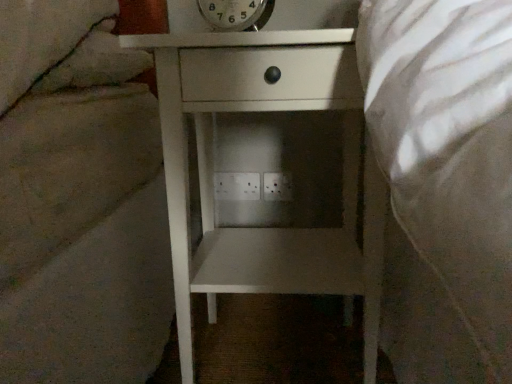
The height and width of the screenshot is (384, 512). What are the coordinates of `white plastic electric outlet at center, arranged as the 2th electric outlet when viewed from the left` in the screenshot? It's located at [x=277, y=187].

Considering the relative sizes of white matte nightstand at center and white plastic electric outlet at center, which is the 1th electric outlet in left-to-right order, in the image provided, is white matte nightstand at center bigger than white plastic electric outlet at center, which is the 1th electric outlet in left-to-right order,?

Correct, white matte nightstand at center is larger in size than white plastic electric outlet at center, which is the 1th electric outlet in left-to-right order.

Considering the relative sizes of white matte nightstand at center and white plastic electric outlet at center, which is the 1th electric outlet in left-to-right order, in the image provided, is white matte nightstand at center thinner than white plastic electric outlet at center, which is the 1th electric outlet in left-to-right order,?

No.

How distant is white matte nightstand at center from white plastic electric outlet at center, positioned as the second electric outlet in right-to-left order?

They are 39.01 centimeters apart.

From the image's perspective, is white matte nightstand at center located above or below white plastic electric outlet at center, arranged as the 2th electric outlet when viewed from the left?

white matte nightstand at center is situated lower than white plastic electric outlet at center, arranged as the 2th electric outlet when viewed from the left, in the image.

Considering the relative sizes of white matte nightstand at center and white plastic electric outlet at center, arranged as the 2th electric outlet when viewed from the left, in the image provided, is white matte nightstand at center bigger than white plastic electric outlet at center, arranged as the 2th electric outlet when viewed from the left,?

Yes.

Is white plastic electric outlet at center, which appears as the 1th electric outlet when viewed from the right, inside white matte nightstand at center?

Definitely not — white plastic electric outlet at center, which appears as the 1th electric outlet when viewed from the right, is not inside white matte nightstand at center.

Is white matte nightstand at center looking in the opposite direction of white plastic electric outlet at center, arranged as the 2th electric outlet when viewed from the left?

Yes, white matte nightstand at center is positioned with its back facing white plastic electric outlet at center, arranged as the 2th electric outlet when viewed from the left.

Between white plastic electric outlet at center, which appears as the 1th electric outlet when viewed from the right, and white plastic electric outlet at center, positioned as the second electric outlet in right-to-left order, which one has smaller size?

white plastic electric outlet at center, which appears as the 1th electric outlet when viewed from the right.

Considering the relative positions of white plastic electric outlet at center, arranged as the 2th electric outlet when viewed from the left, and white plastic electric outlet at center, positioned as the second electric outlet in right-to-left order, in the image provided, is white plastic electric outlet at center, arranged as the 2th electric outlet when viewed from the left, to the right of white plastic electric outlet at center, positioned as the second electric outlet in right-to-left order, from the viewer's perspective?

Yes.

In the scene shown: Are white plastic electric outlet at center, which appears as the 1th electric outlet when viewed from the right, and white plastic electric outlet at center, which is the 1th electric outlet in left-to-right order, located far from each other?

No, white plastic electric outlet at center, which appears as the 1th electric outlet when viewed from the right, is not far away from white plastic electric outlet at center, which is the 1th electric outlet in left-to-right order.

Is white plastic electric outlet at center, arranged as the 2th electric outlet when viewed from the left, looking in the opposite direction of white plastic electric outlet at center, positioned as the second electric outlet in right-to-left order?

white plastic electric outlet at center, arranged as the 2th electric outlet when viewed from the left, does not have its back to white plastic electric outlet at center, positioned as the second electric outlet in right-to-left order.

In terms of height, does white plastic electric outlet at center, which is the 1th electric outlet in left-to-right order, look taller or shorter compared to white matte nightstand at center?

Clearly, white plastic electric outlet at center, which is the 1th electric outlet in left-to-right order, is shorter compared to white matte nightstand at center.

Is white plastic electric outlet at center, which is the 1th electric outlet in left-to-right order, not within white matte nightstand at center?

Absolutely, white plastic electric outlet at center, which is the 1th electric outlet in left-to-right order, is external to white matte nightstand at center.

Is white matte nightstand at center at the back of white plastic electric outlet at center, positioned as the second electric outlet in right-to-left order?

No.

From the image's perspective, is white plastic electric outlet at center, which is the 1th electric outlet in left-to-right order, below white matte nightstand at center?

No, from the image's perspective, white plastic electric outlet at center, which is the 1th electric outlet in left-to-right order, is not beneath white matte nightstand at center.

Is metallic silver clock at upper center wider or thinner than white plastic electric outlet at center, which appears as the 1th electric outlet when viewed from the right?

Clearly, metallic silver clock at upper center has more width compared to white plastic electric outlet at center, which appears as the 1th electric outlet when viewed from the right.

Is point (202, 0) behind point (267, 190)?

No, (202, 0) is in front of (267, 190).

From the image's perspective, which one is positioned higher, metallic silver clock at upper center or white plastic electric outlet at center, arranged as the 2th electric outlet when viewed from the left?

metallic silver clock at upper center appears higher in the image.

Does metallic silver clock at upper center appear on the left side of white plastic electric outlet at center, arranged as the 2th electric outlet when viewed from the left?

Correct, you'll find metallic silver clock at upper center to the left of white plastic electric outlet at center, arranged as the 2th electric outlet when viewed from the left.

Is white plastic electric outlet at center, arranged as the 2th electric outlet when viewed from the left, not near white matte nightstand at center?

No, white plastic electric outlet at center, arranged as the 2th electric outlet when viewed from the left, is not far away from white matte nightstand at center.

Is white plastic electric outlet at center, which appears as the 1th electric outlet when viewed from the right, located outside white matte nightstand at center?

Absolutely, white plastic electric outlet at center, which appears as the 1th electric outlet when viewed from the right, is external to white matte nightstand at center.

Is white plastic electric outlet at center, which appears as the 1th electric outlet when viewed from the right, positioned behind white matte nightstand at center?

Yes, white plastic electric outlet at center, which appears as the 1th electric outlet when viewed from the right, is further from the camera.

Could you measure the distance between white plastic electric outlet at center, which appears as the 1th electric outlet when viewed from the right, and white matte nightstand at center?

white plastic electric outlet at center, which appears as the 1th electric outlet when viewed from the right, and white matte nightstand at center are 15.54 inches apart.

Between white plastic electric outlet at center, positioned as the second electric outlet in right-to-left order, and metallic silver clock at upper center, which one appears on the left side from the viewer's perspective?

Positioned to the left is white plastic electric outlet at center, positioned as the second electric outlet in right-to-left order.

How many degrees apart are the facing directions of white plastic electric outlet at center, positioned as the second electric outlet in right-to-left order, and metallic silver clock at upper center?

The facing directions of white plastic electric outlet at center, positioned as the second electric outlet in right-to-left order, and metallic silver clock at upper center are 10.7 degrees apart.

Measure the distance from white plastic electric outlet at center, which is the 1th electric outlet in left-to-right order, to metallic silver clock at upper center.

white plastic electric outlet at center, which is the 1th electric outlet in left-to-right order, and metallic silver clock at upper center are 19.66 inches apart from each other.

Is point (220, 195) farther from camera compared to point (216, 28)?

Yes, it is.

This screenshot has width=512, height=384. Find the location of `electric outlet that is the 2nd one when counting upward from the white matte nightstand at center (from the image's perspective)`. electric outlet that is the 2nd one when counting upward from the white matte nightstand at center (from the image's perspective) is located at coordinates (237, 186).

Locate an element on the screen. The image size is (512, 384). electric outlet on the right side of white matte nightstand at center is located at coordinates (277, 187).

When comparing their distances from white plastic electric outlet at center, positioned as the second electric outlet in right-to-left order, does metallic silver clock at upper center or white matte nightstand at center seem further?

metallic silver clock at upper center.

Which object lies further to the anchor point metallic silver clock at upper center, white plastic electric outlet at center, which is the 1th electric outlet in left-to-right order, or white plastic electric outlet at center, which appears as the 1th electric outlet when viewed from the right?

The object further to metallic silver clock at upper center is white plastic electric outlet at center, which appears as the 1th electric outlet when viewed from the right.

Which object lies further to the anchor point metallic silver clock at upper center, white plastic electric outlet at center, positioned as the second electric outlet in right-to-left order, or white matte nightstand at center?

white plastic electric outlet at center, positioned as the second electric outlet in right-to-left order.

Which object lies further to the anchor point white plastic electric outlet at center, arranged as the 2th electric outlet when viewed from the left, metallic silver clock at upper center or white matte nightstand at center?

metallic silver clock at upper center lies further to white plastic electric outlet at center, arranged as the 2th electric outlet when viewed from the left, than the other object.

Based on their spatial positions, is white plastic electric outlet at center, which is the 1th electric outlet in left-to-right order, or white plastic electric outlet at center, which appears as the 1th electric outlet when viewed from the right, further from white matte nightstand at center?

Among the two, white plastic electric outlet at center, which appears as the 1th electric outlet when viewed from the right, is located further to white matte nightstand at center.

Which object lies further to the anchor point white matte nightstand at center, metallic silver clock at upper center or white plastic electric outlet at center, positioned as the second electric outlet in right-to-left order?

white plastic electric outlet at center, positioned as the second electric outlet in right-to-left order.

Estimate the real-world distances between objects in this image. Which object is further from white plastic electric outlet at center, which is the 1th electric outlet in left-to-right order, white matte nightstand at center or metallic silver clock at upper center?

metallic silver clock at upper center.

From the image, which object appears to be nearer to white matte nightstand at center, metallic silver clock at upper center or white plastic electric outlet at center, which appears as the 1th electric outlet when viewed from the right?

metallic silver clock at upper center is positioned closer to the anchor white matte nightstand at center.

This screenshot has height=384, width=512. I want to click on alarm clock between white matte nightstand at center and white plastic electric outlet at center, arranged as the 2th electric outlet when viewed from the left, along the z-axis, so click(x=236, y=14).

Identify the location of electric outlet positioned between metallic silver clock at upper center and white plastic electric outlet at center, which is the 1th electric outlet in left-to-right order, from near to far. (277, 187).

Locate an element on the screen. The image size is (512, 384). electric outlet located between white matte nightstand at center and white plastic electric outlet at center, which is the 1th electric outlet in left-to-right order, in the depth direction is located at coordinates (277, 187).

The width and height of the screenshot is (512, 384). What are the coordinates of `alarm clock between white matte nightstand at center and white plastic electric outlet at center, positioned as the second electric outlet in right-to-left order, in the front-back direction` in the screenshot? It's located at (236, 14).